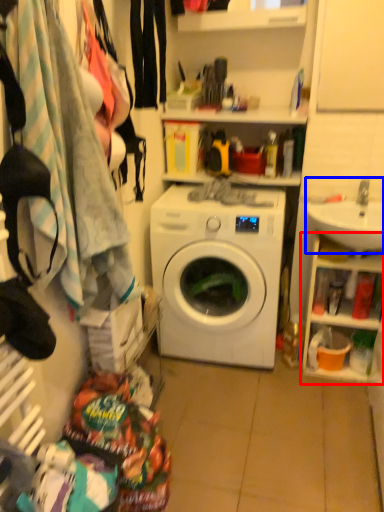
Question: Which object is closer to the camera taking this photo, cabinet (highlighted by a red box) or sink (highlighted by a blue box)?

Choices:
 (A) cabinet
 (B) sink

Answer: (B)